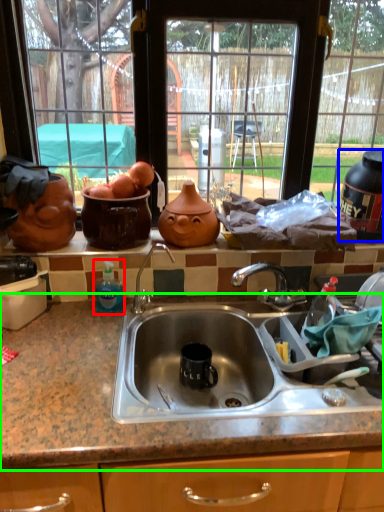
Question: Which is nearer to the bottle (highlighted by a red box)? appliance (highlighted by a blue box) or countertop (highlighted by a green box).

Choices:
 (A) appliance
 (B) countertop

Answer: (B)